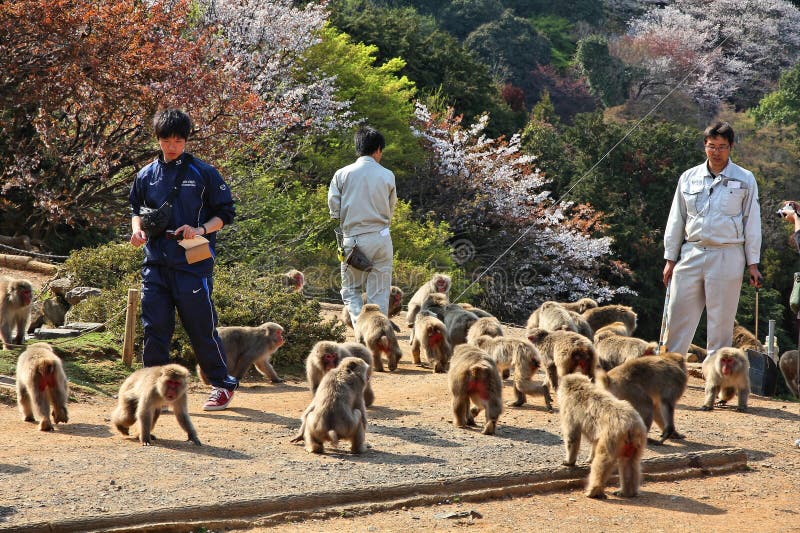
Where is `cable`? The height and width of the screenshot is (533, 800). cable is located at coordinates (517, 257).